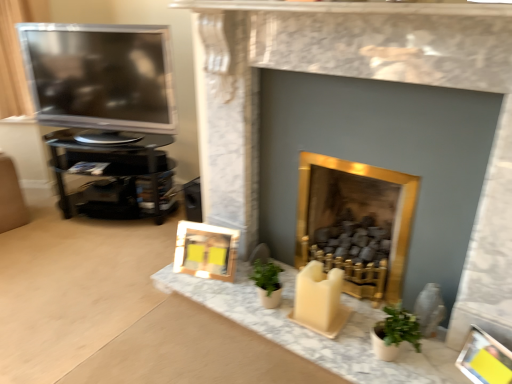
The image size is (512, 384). I want to click on space that is in front of black glossy tv stand at left, so click(x=78, y=267).